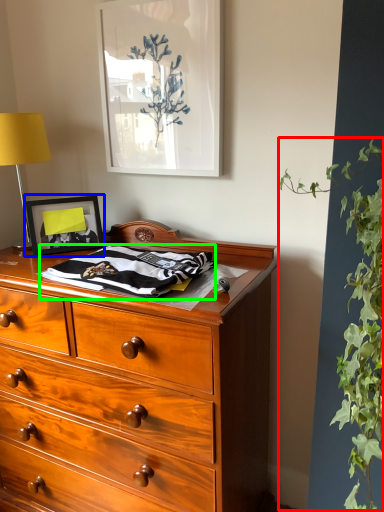
Question: Which object is the closest to the vegetation (highlighted by a red box)? Choose among these: picture frame (highlighted by a blue box) or blanket (highlighted by a green box).

Choices:
 (A) picture frame
 (B) blanket

Answer: (B)